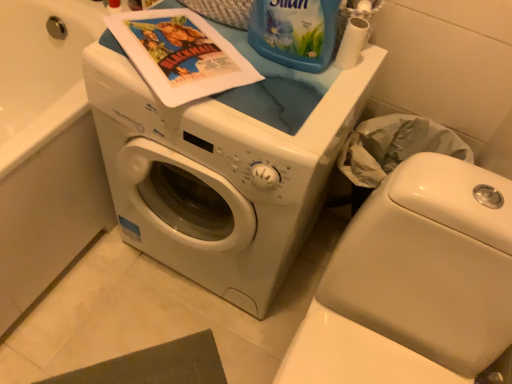
Where is `free space to the left of white matte toilet paper at upper right`? Image resolution: width=512 pixels, height=384 pixels. free space to the left of white matte toilet paper at upper right is located at coordinates (272, 66).